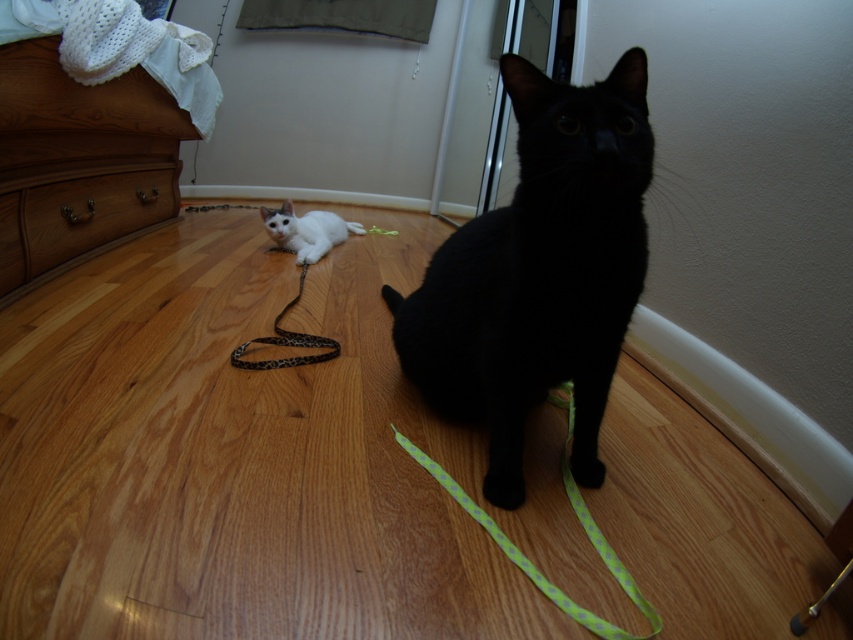
Is brown wood drawer at left below leopard print fabric leash at center?

Actually, brown wood drawer at left is above leopard print fabric leash at center.

Does point (125, 172) lie in front of point (316, 346)?

No, (125, 172) is further to viewer.

Where is `brown wood drawer at left`? brown wood drawer at left is located at coordinates (91, 212).

Which of these two, white fur cat at lower left or leopard print fabric leash at center, stands taller?

white fur cat at lower left is taller.

Is white fur cat at lower left shorter than leopard print fabric leash at center?

Incorrect, white fur cat at lower left's height does not fall short of leopard print fabric leash at center's.

Image resolution: width=853 pixels, height=640 pixels. I want to click on white fur cat at lower left, so click(306, 230).

Does black glossy cat at center appear under brown wood drawer at left?

Indeed, black glossy cat at center is positioned under brown wood drawer at left.

The height and width of the screenshot is (640, 853). Identify the location of black glossy cat at center. (538, 273).